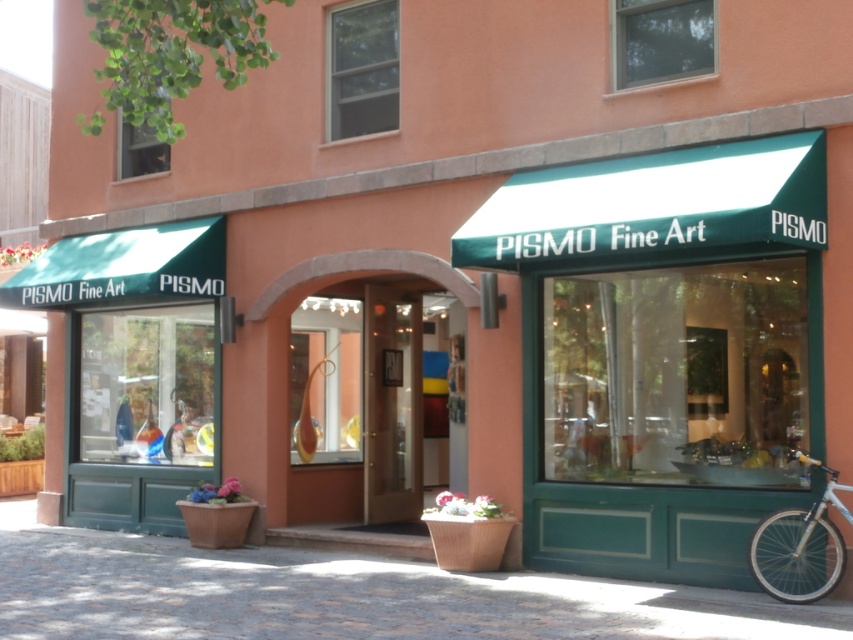
You are standing in front of the Pismo Fine Art store and see two points marked on the glass window. The first point is at coordinate (689, 604) and the second is at (833, 470). Which point is closer to you?

Point (833, 470) is closer to you because it is in front of point (689, 604).

You are standing in front of Pismo Fine Art and want to place a small potted plant exactly where the cobblestone pavement at lower center is located. What coordinates should you use?

The coordinates for the cobblestone pavement at lower center are at point (x=346, y=596), so you should place the potted plant there.

You are a customer arriving at Pismo Fine Art and notice the cobblestone pavement at lower center and the white metallic bicycle at lower right. Which object takes up more space in the image?

The cobblestone pavement at lower center takes up more space in the image because it is bigger than the white metallic bicycle at lower right.